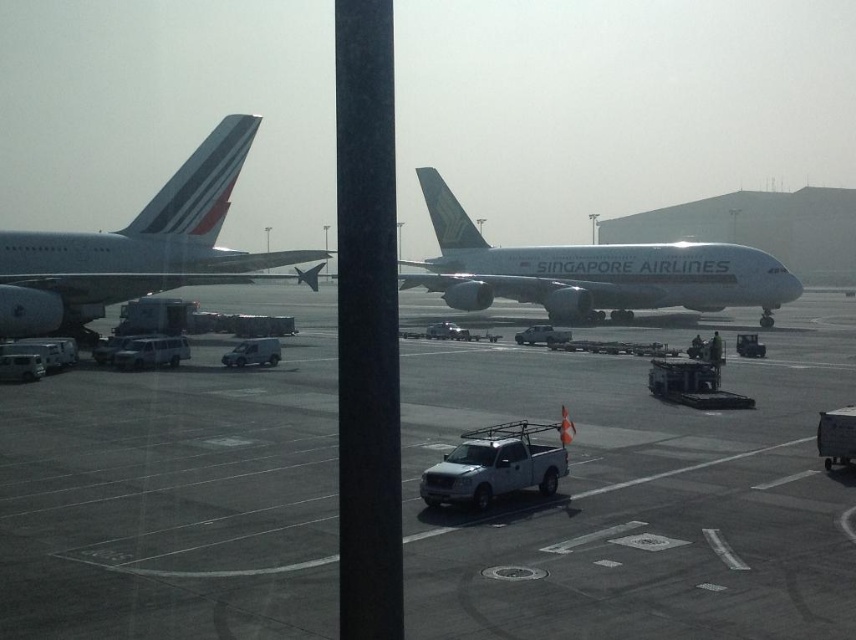
Question: Among these objects, which one is farthest from the camera?

Choices:
 (A) white glossy airplane at left
 (B) white glossy airplane at center
 (C) gray asphalt tarmac at center

Answer: (B)

Question: Is white glossy airplane at left bigger than white glossy airplane at center?

Choices:
 (A) yes
 (B) no

Answer: (B)

Question: Is white glossy airplane at left wider than white glossy airplane at center?

Choices:
 (A) no
 (B) yes

Answer: (A)

Question: Which of these objects is positioned farthest from the white glossy airplane at center?

Choices:
 (A) white glossy airplane at left
 (B) gray asphalt tarmac at center

Answer: (A)

Question: Is gray asphalt tarmac at center positioned behind white glossy airplane at center?

Choices:
 (A) yes
 (B) no

Answer: (B)

Question: Which object is the farthest from the white glossy airplane at center?

Choices:
 (A) gray asphalt tarmac at center
 (B) white glossy airplane at left

Answer: (B)